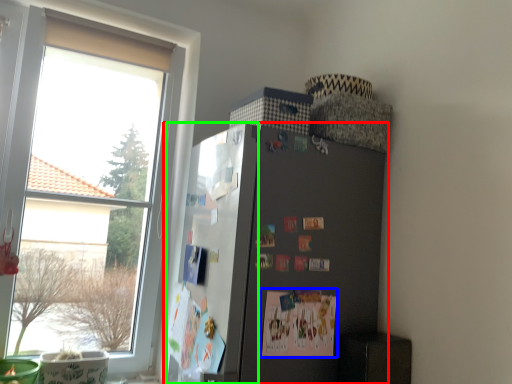
Question: Based on their relative distances, which object is farther from refrigerator (highlighted by a red box)? Choose from postcard (highlighted by a blue box) and bulletin board (highlighted by a green box).

Choices:
 (A) postcard
 (B) bulletin board

Answer: (A)